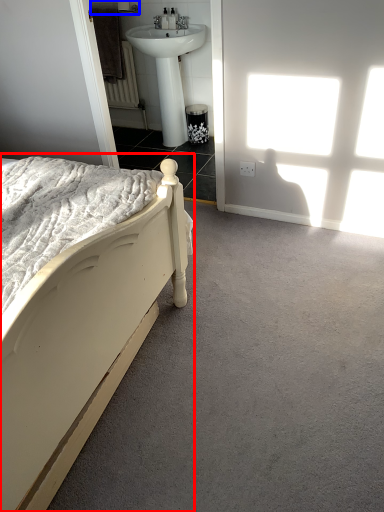
Question: Which object appears closest to the camera in this image, bed (highlighted by a red box) or towel bar (highlighted by a blue box)?

Choices:
 (A) bed
 (B) towel bar

Answer: (A)